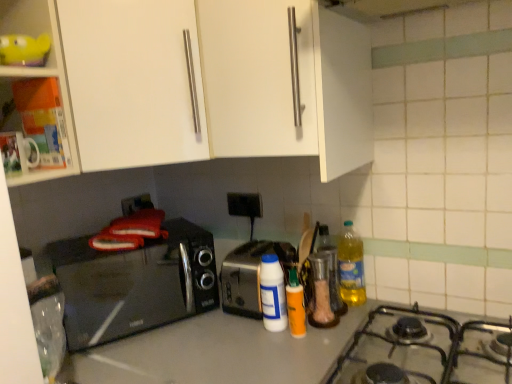
In order to face black matte microwave at left, should I rotate leftwards or rightwards?

You should rotate left by 16.491 degrees.

What do you see at coordinates (256, 77) in the screenshot? I see `white matte cabinet at upper center, positioned as the 3th cabinetry in left-to-right order` at bounding box center [256, 77].

How much space does white glossy cabinet at upper left, which appears as the 3th cabinetry when viewed from the right, occupy vertically?

45.37 centimeters.

Find the location of `translucent plastic bottle at center, the third bottle positioned from the left`. translucent plastic bottle at center, the third bottle positioned from the left is located at coordinates (331, 270).

The image size is (512, 384). Identify the location of silver metallic toaster at center. (250, 275).

Which object is thinner, metallic gray gas stove at lower right or silver metallic toaster at center?

silver metallic toaster at center is thinner.

From the picture: From a real-world perspective, is metallic gray gas stove at lower right located beneath silver metallic toaster at center?

Yes, from a real-world perspective, metallic gray gas stove at lower right is beneath silver metallic toaster at center.

In the scene shown: From the image's perspective, is metallic gray gas stove at lower right beneath silver metallic toaster at center?

Yes, from the image's perspective, metallic gray gas stove at lower right is below silver metallic toaster at center.

Is metallic gray gas stove at lower right in front of or behind silver metallic toaster at center in the image?

Visually, metallic gray gas stove at lower right is located in front of silver metallic toaster at center.

Can you confirm if black plastic outlet at center is positioned to the right of yellow translucent bottle at right?

No, black plastic outlet at center is not to the right of yellow translucent bottle at right.

From the image's perspective, would you say black plastic outlet at center is positioned over yellow translucent bottle at right?

Yes, from the image's perspective, black plastic outlet at center is over yellow translucent bottle at right.

Who is shorter, black plastic outlet at center or yellow translucent bottle at right?

black plastic outlet at center is shorter.

Does black plastic outlet at center have a smaller size compared to yellow translucent bottle at right?

Yes, black plastic outlet at center is smaller than yellow translucent bottle at right.

Considering the relative positions of white glossy cabinet at upper left, which appears as the 3th cabinetry when viewed from the right, and yellow plastic container at upper left in the image provided, is white glossy cabinet at upper left, which appears as the 3th cabinetry when viewed from the right, in front of yellow plastic container at upper left?

Yes, white glossy cabinet at upper left, which appears as the 3th cabinetry when viewed from the right, is in front of yellow plastic container at upper left.

From the picture: Between white glossy cabinet at upper left, which appears as the 3th cabinetry when viewed from the right, and yellow plastic container at upper left, which one appears on the right side from the viewer's perspective?

Positioned to the right is yellow plastic container at upper left.

In terms of width, does white glossy cabinet at upper left, which is the first cabinetry in left-to-right order, look wider or thinner when compared to yellow plastic container at upper left?

Considering their sizes, white glossy cabinet at upper left, which is the first cabinetry in left-to-right order, looks broader than yellow plastic container at upper left.

Considering the points (8, 7) and (53, 11), which point is behind, point (8, 7) or point (53, 11)?

Positioned behind is point (8, 7).

Could you tell me if yellow translucent bottle at right is turned towards white glossy cabinet at upper left, which appears as the 3th cabinetry when viewed from the right?

No, yellow translucent bottle at right is not facing towards white glossy cabinet at upper left, which appears as the 3th cabinetry when viewed from the right.

Which object is closer to the camera taking this photo, yellow translucent bottle at right or white glossy cabinet at upper left, which appears as the 3th cabinetry when viewed from the right?

white glossy cabinet at upper left, which appears as the 3th cabinetry when viewed from the right, is in front.

The width and height of the screenshot is (512, 384). There is a yellow translucent bottle at right. Identify the location of the 2nd cabinetry above it (from a real-world perspective). (40, 71).

Would you say yellow translucent bottle at right is inside or outside white glossy cabinet at upper left, which is the first cabinetry in left-to-right order?

yellow translucent bottle at right is located beyond the bounds of white glossy cabinet at upper left, which is the first cabinetry in left-to-right order.

Which object is further away from the camera, white plastic bottle at center, the first bottle positioned from the left, or white matte cabinet at upper left, which is counted as the second cabinetry, starting from the left?

white plastic bottle at center, the first bottle positioned from the left.

Which point is more forward, (276, 255) or (125, 36)?

Point (125, 36)

How much distance is there between white plastic bottle at center, the first bottle positioned from the left, and white matte cabinet at upper left, which is counted as the second cabinetry, starting from the left?

A distance of 22.15 inches exists between white plastic bottle at center, the first bottle positioned from the left, and white matte cabinet at upper left, which is counted as the second cabinetry, starting from the left.

Is white plastic bottle at center, the first bottle positioned from the left, with white matte cabinet at upper left, which is counted as the second cabinetry, starting from the left?

white plastic bottle at center, the first bottle positioned from the left, and white matte cabinet at upper left, which is counted as the second cabinetry, starting from the left, are not in contact.

From a real-world perspective, which object rests below the other?

smooth gray countertop at center.

In the image, there is a silver metallic toaster at center. Where is `countertop below it (from the image's perspective)`? This screenshot has width=512, height=384. countertop below it (from the image's perspective) is located at coordinates (220, 349).

Which of these two, silver metallic toaster at center or smooth gray countertop at center, is smaller?

silver metallic toaster at center is smaller.

Which object is positioned more to the right, silver metallic toaster at center or smooth gray countertop at center?

silver metallic toaster at center is more to the right.

Between black plastic outlet at center and translucent plastic bottle at center, the third bottle positioned from the left, which one is positioned behind?

Positioned behind is black plastic outlet at center.

Between black plastic outlet at center and translucent plastic bottle at center, the third bottle positioned from the left, which one appears on the left side from the viewer's perspective?

From the viewer's perspective, black plastic outlet at center appears more on the left side.

Who is smaller, black plastic outlet at center or translucent plastic bottle at center, the third bottle positioned from the left?

black plastic outlet at center is smaller.

Can you tell me how much black plastic outlet at center and translucent plastic bottle at center, the third bottle positioned from the left, differ in facing direction?

There is a 0.755-degree angle between the facing directions of black plastic outlet at center and translucent plastic bottle at center, the third bottle positioned from the left.

Where is `toaster above the metallic gray gas stove at lower right (from a real-world perspective)`? This screenshot has width=512, height=384. toaster above the metallic gray gas stove at lower right (from a real-world perspective) is located at coordinates (250, 275).

Identify the location of kitchen appliance below the black plastic outlet at center (from the image's perspective). (351, 266).

Which object lies nearer to the anchor point black plastic outlet at center, yellow plastic container at upper left or white matte cabinet at upper left, which is counted as the second cabinetry, starting from the left?

white matte cabinet at upper left, which is counted as the second cabinetry, starting from the left, is closer to black plastic outlet at center.

From the picture: Estimate the real-world distances between objects in this image. Which object is closer to black matte microwave at left, smooth gray countertop at center or translucent plastic bottle at center, arranged as the first bottle when viewed from the right?

The object closer to black matte microwave at left is smooth gray countertop at center.

Which object lies further to the anchor point silver metallic toaster at center, clear glass container at center or black plastic outlet at center?

Among the two, black plastic outlet at center is located further to silver metallic toaster at center.

Based on their spatial positions, is yellow plastic container at upper left or white glossy cabinet at upper left, which appears as the 3th cabinetry when viewed from the right, closer to white plastic bottle at center, which ranks as the third bottle in right-to-left order?

white glossy cabinet at upper left, which appears as the 3th cabinetry when viewed from the right.

Looking at the image, which one is located closer to yellow translucent bottle at right, black matte microwave at left or white matte cabinet at upper center, the 1th cabinetry when ordered from right to left?

white matte cabinet at upper center, the 1th cabinetry when ordered from right to left, is closer to yellow translucent bottle at right.

Estimate the real-world distances between objects in this image. Which object is further from white glossy cabinet at upper left, which is the first cabinetry in left-to-right order, yellow plastic container at upper left or orange matte bottle at center, acting as the 2th bottle starting from the left?

orange matte bottle at center, acting as the 2th bottle starting from the left, is positioned further to the anchor white glossy cabinet at upper left, which is the first cabinetry in left-to-right order.

Looking at the image, which one is located closer to white glossy cabinet at upper left, which is the first cabinetry in left-to-right order, black plastic outlet at center or translucent plastic bottle at center, the third bottle positioned from the left?

black plastic outlet at center lies closer to white glossy cabinet at upper left, which is the first cabinetry in left-to-right order, than the other object.

Estimate the real-world distances between objects in this image. Which object is further from smooth gray countertop at center, metallic gray gas stove at lower right or clear glass container at center?

clear glass container at center is further to smooth gray countertop at center.

Image resolution: width=512 pixels, height=384 pixels. What are the coordinates of `appliance between white matte cabinet at upper center, positioned as the 3th cabinetry in left-to-right order, and white plastic bottle at center, which ranks as the third bottle in right-to-left order, in the vertical direction` in the screenshot? It's located at (321, 293).

You are a GUI agent. You are given a task and a screenshot of the screen. Output one action in this format:
    pyautogui.click(x=<x>, y=<y>)
    Task: Click on the toaster between white glossy cabinet at upper left, which is the first cabinetry in left-to-right order, and metallic gray gas stove at lower right
    
    Given the screenshot: What is the action you would take?
    pyautogui.click(x=250, y=275)

Find the location of `bottle between white matte cabinet at upper center, positioned as the 3th cabinetry in left-to-right order, and white plastic bottle at center, the first bottle positioned from the left, in the vertical direction`. bottle between white matte cabinet at upper center, positioned as the 3th cabinetry in left-to-right order, and white plastic bottle at center, the first bottle positioned from the left, in the vertical direction is located at coordinates (331, 270).

Image resolution: width=512 pixels, height=384 pixels. I want to click on toaster between white matte cabinet at upper left, which is the 2th cabinetry in right-to-left order, and black matte microwave at left, in the vertical direction, so click(250, 275).